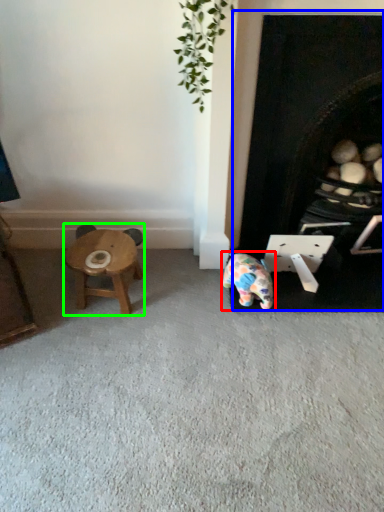
Question: Based on their relative distances, which object is farther from toy (highlighted by a red box)? Choose from fireplace (highlighted by a blue box) and stool (highlighted by a green box).

Choices:
 (A) fireplace
 (B) stool

Answer: (B)